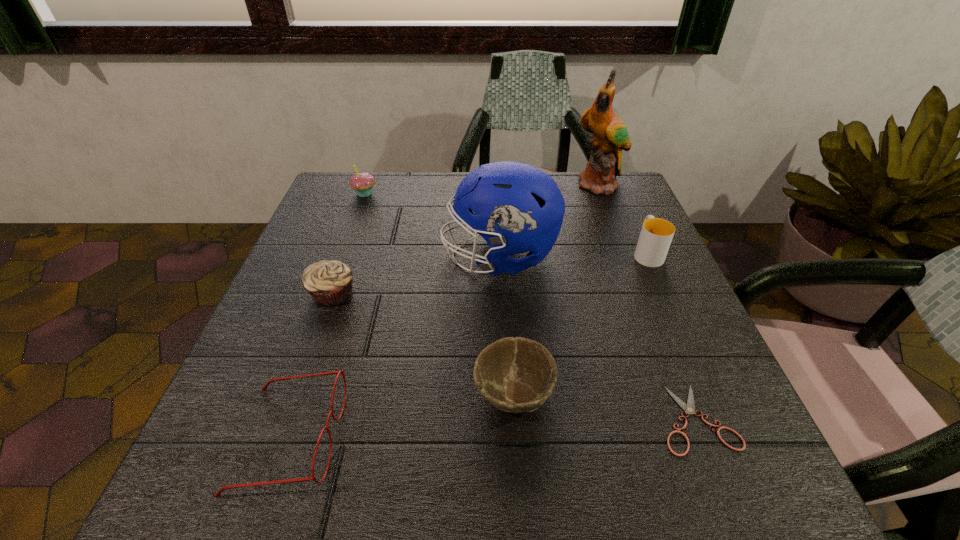
In order to click on vacant space that's between the tallest object and the shortest object in this screenshot , I will do `click(648, 302)`.

I want to click on free point between the bowl and the second tallest object, so click(x=507, y=326).

Identify the location of free space between the shortest object and the football helmet. (598, 338).

The height and width of the screenshot is (540, 960). I want to click on vacant area that lies between the cupcake and the bowl, so click(439, 294).

This screenshot has width=960, height=540. Identify the location of empty space between the spectacles and the bowl. (401, 416).

This screenshot has width=960, height=540. I want to click on free space between the shortest object and the cupcake, so click(530, 306).

The height and width of the screenshot is (540, 960). Identify the location of vacant area between the cupcake and the spectacles. (327, 316).

Identify which object is the third nearest to the bowl. Please provide its 2D coordinates. Your answer should be formatted as a tuple, i.e. [(x, y)], where the tuple contains the x and y coordinates of a point satisfying the conditions above.

[(264, 388)]

Identify which object is the third closest to the shortest object. Please provide its 2D coordinates. Your answer should be formatted as a tuple, i.e. [(x, y)], where the tuple contains the x and y coordinates of a point satisfying the conditions above.

[(656, 234)]

You are a GUI agent. You are given a task and a screenshot of the screen. Output one action in this format:
    pyautogui.click(x=<x>, y=<y>)
    Task: Click on the vacant space that satisfies the following two spatial constraints: 1. on the front-facing side of the tallest object; 2. on the front-facing side of the seventh shortest object
    The image size is (960, 540).
    Given the screenshot: What is the action you would take?
    pyautogui.click(x=627, y=256)